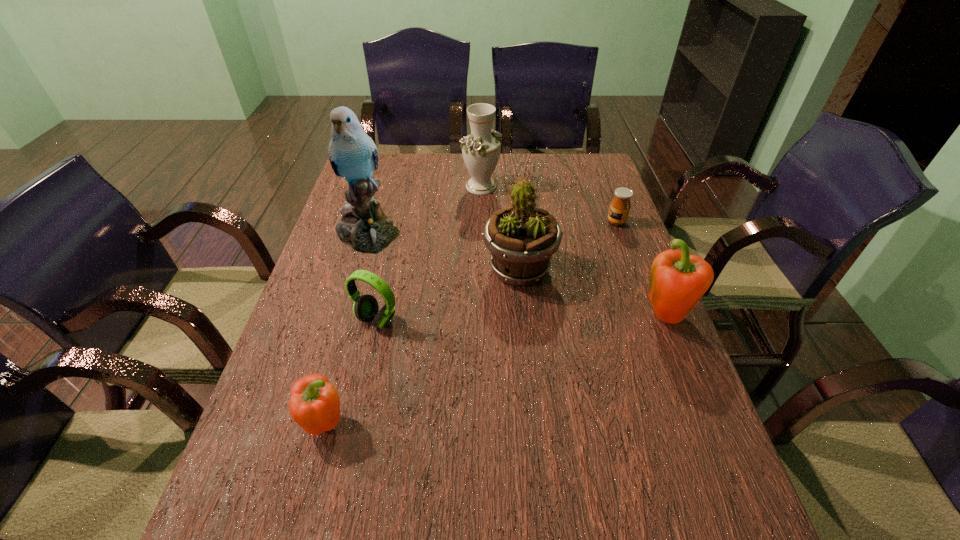
To ensure equal spacing by inserting another pepper among them, please point out a vacant spot for this new pepper. Please provide its 2D coordinates. Your answer should be formatted as a tuple, i.e. [(x, y)], where the tuple contains the x and y coordinates of a point satisfying the conditions above.

[(514, 364)]